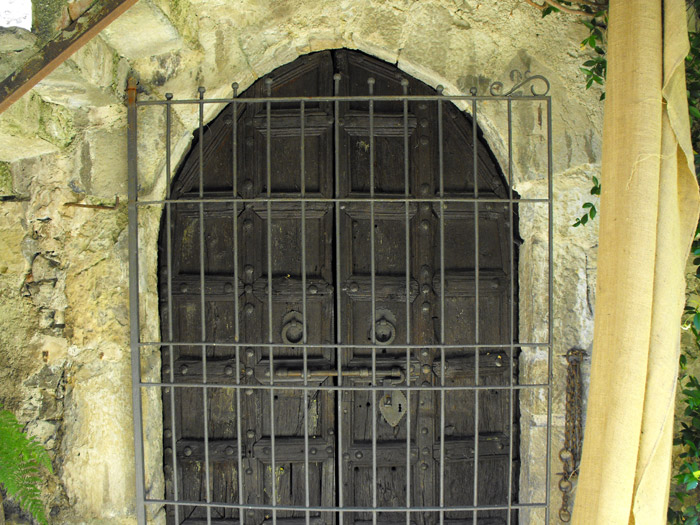
Locate an element on the screen. door's large sliding lock is located at coordinates (392, 370).